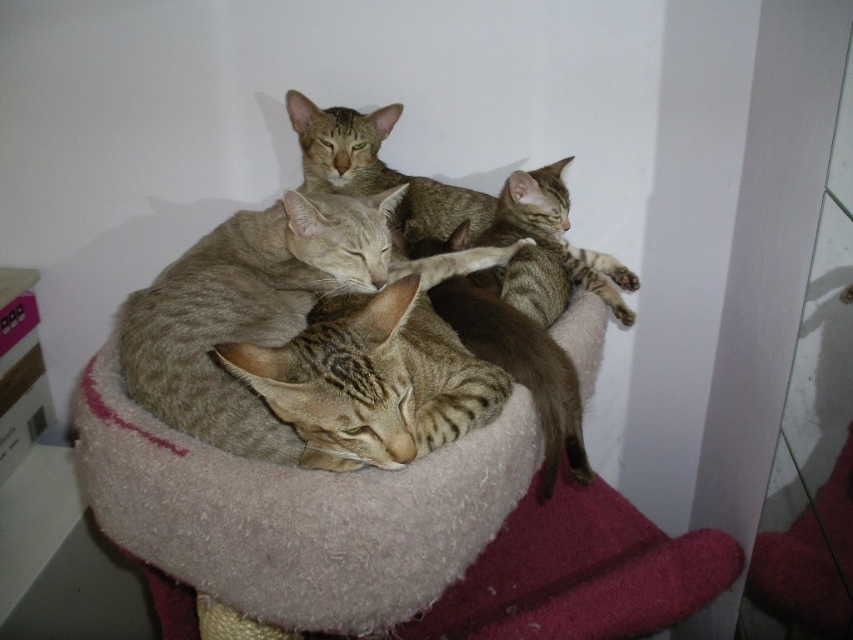
Question: Where is beige woolen cat bed at center located in relation to tabby fur cat at center in the image?

Choices:
 (A) right
 (B) left

Answer: (B)

Question: Does beige woolen cat bed at center have a lesser width compared to tabby fur cat at center?

Choices:
 (A) yes
 (B) no

Answer: (B)

Question: Which of the following is the closest to the observer?

Choices:
 (A) (345, 572)
 (B) (363, 129)

Answer: (A)

Question: Which point is closer to the camera taking this photo?

Choices:
 (A) (434, 227)
 (B) (390, 577)

Answer: (B)

Question: Does beige woolen cat bed at center have a greater width compared to tabby fur cat at center?

Choices:
 (A) yes
 (B) no

Answer: (A)